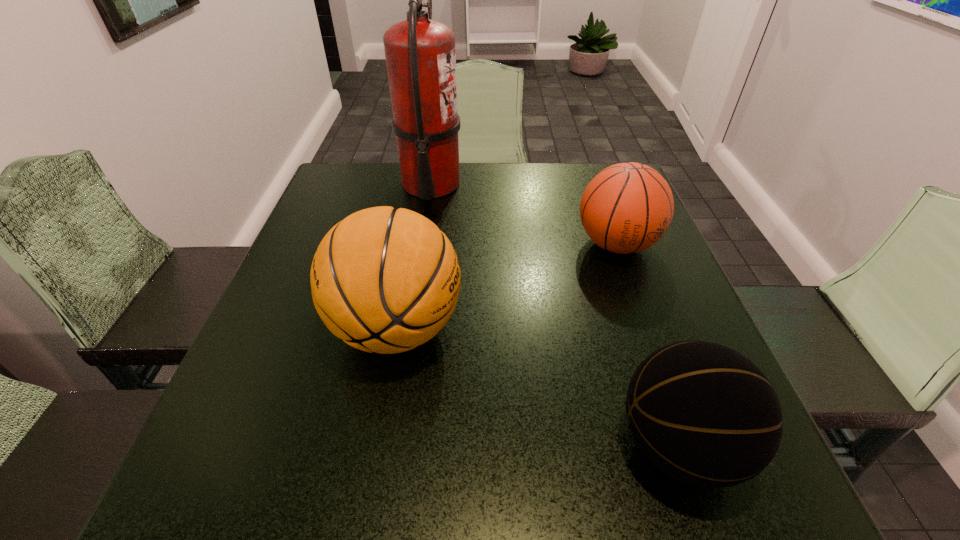
Identify the location of object that is positioned at the far edge. (420, 56).

At what (x,y) coordinates should I click in order to perform the action: click on object present at the near edge. Please return your answer as a coordinate pair (x, y). The height and width of the screenshot is (540, 960). Looking at the image, I should click on (703, 413).

Locate an element on the screen. Image resolution: width=960 pixels, height=540 pixels. object at the left edge is located at coordinates (384, 280).

You are a GUI agent. You are given a task and a screenshot of the screen. Output one action in this format:
    pyautogui.click(x=<x>, y=<y>)
    Task: Click on the object that is at the near right corner
    The width and height of the screenshot is (960, 540).
    Given the screenshot: What is the action you would take?
    pyautogui.click(x=703, y=413)

The height and width of the screenshot is (540, 960). I want to click on free spot at the far edge of the desktop, so click(x=390, y=173).

Where is `free space at the left edge of the desktop`? free space at the left edge of the desktop is located at coordinates [296, 322].

Identify the location of free region at the right edge. The width and height of the screenshot is (960, 540). 640,286.

This screenshot has height=540, width=960. In order to click on free space at the far left corner in this screenshot , I will do `click(355, 186)`.

This screenshot has height=540, width=960. What are the coordinates of `free spot at the near left corner of the desktop` in the screenshot? It's located at (236, 505).

This screenshot has height=540, width=960. In order to click on vacant region at the far right corner of the desktop in this screenshot , I will do point(575,182).